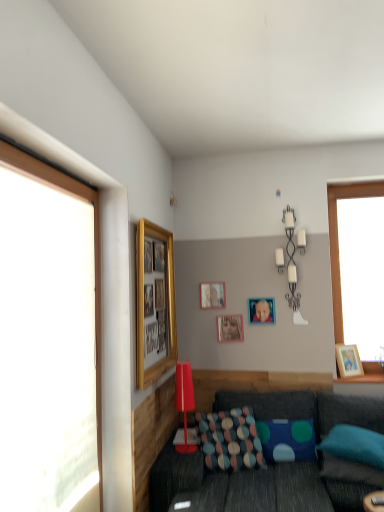
Question: Does gold/glossy picture frame at upper left, which appears as the first picture frame when viewed from the left, contain textured fabric pillow at lower center, the 1th pillow positioned from the left?

Choices:
 (A) yes
 (B) no

Answer: (B)

Question: Is gold/glossy picture frame at upper left, the 1th picture frame viewed from the front, next to textured fabric pillow at lower center, the 1th pillow positioned from the left?

Choices:
 (A) yes
 (B) no

Answer: (B)

Question: From a real-world perspective, is gold/glossy picture frame at upper left, the 1th picture frame viewed from the front, physically above textured fabric pillow at lower center, the third pillow viewed from the right?

Choices:
 (A) yes
 (B) no

Answer: (A)

Question: Considering the relative positions of gold/glossy picture frame at upper left, acting as the fifth picture frame starting from the back, and textured fabric pillow at lower center, the third pillow viewed from the right, in the image provided, is gold/glossy picture frame at upper left, acting as the fifth picture frame starting from the back, in front of textured fabric pillow at lower center, the third pillow viewed from the right,?

Choices:
 (A) yes
 (B) no

Answer: (A)

Question: Can you confirm if gold/glossy picture frame at upper left, which appears as the first picture frame when viewed from the left, is taller than textured fabric pillow at lower center, the third pillow viewed from the right?

Choices:
 (A) yes
 (B) no

Answer: (A)

Question: In the image, is transparent glass window at left on the left side or the right side of wooden picture frame at right, the fifth picture frame in the left-to-right sequence?

Choices:
 (A) right
 (B) left

Answer: (B)

Question: In terms of size, does transparent glass window at left appear bigger or smaller than wooden picture frame at right, the fifth picture frame in the left-to-right sequence?

Choices:
 (A) small
 (B) big

Answer: (B)

Question: Which is correct: transparent glass window at left is inside wooden picture frame at right, marked as the 4th picture frame in a back-to-front arrangement, or outside of it?

Choices:
 (A) inside
 (B) outside

Answer: (B)

Question: Considering the positions of point (99, 358) and point (349, 365), is point (99, 358) closer or farther from the camera than point (349, 365)?

Choices:
 (A) farther
 (B) closer

Answer: (B)

Question: In terms of width, does textured fabric pillow at lower center, the 1th pillow positioned from the left, look wider or thinner when compared to metallic silver photo frame at center, acting as the 2th picture frame starting from the right?

Choices:
 (A) thin
 (B) wide

Answer: (B)

Question: From a real-world perspective, is textured fabric pillow at lower center, the third pillow viewed from the right, physically located above or below metallic silver photo frame at center, the third picture frame viewed from the back?

Choices:
 (A) above
 (B) below

Answer: (B)

Question: Is textured fabric pillow at lower center, the third pillow viewed from the right, to the left or to the right of metallic silver photo frame at center, which appears as the fourth picture frame when viewed from the left, in the image?

Choices:
 (A) right
 (B) left

Answer: (B)

Question: Considering the positions of point (221, 446) and point (254, 313), is point (221, 446) closer or farther from the camera than point (254, 313)?

Choices:
 (A) closer
 (B) farther

Answer: (A)

Question: In the image, is wooden picture frame at right, marked as the 4th picture frame in a back-to-front arrangement, on the left side or the right side of blue fabric pillow at lower right, which is counted as the 3th pillow, starting from the left?

Choices:
 (A) right
 (B) left

Answer: (A)

Question: Is wooden picture frame at right, marked as the second picture frame in a front-to-back arrangement, spatially inside blue fabric pillow at lower right, which is counted as the 3th pillow, starting from the left, or outside of it?

Choices:
 (A) outside
 (B) inside

Answer: (A)